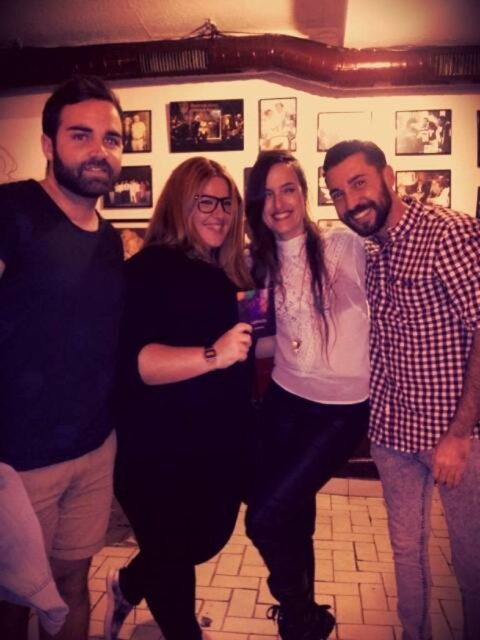
Question: Estimate the real-world distances between objects in this image. Which object is farther from the red checkered shirt at right?

Choices:
 (A) black matte shirt at left
 (B) wooden photo frame at upper center

Answer: (B)

Question: Is red checkered shirt at right to the right of wooden photo frame at upper center from the viewer's perspective?

Choices:
 (A) yes
 (B) no

Answer: (A)

Question: Among these objects, which one is nearest to the camera?

Choices:
 (A) wooden photo frame at upper center
 (B) black matte shirt at left
 (C) red checkered shirt at right

Answer: (B)

Question: Is black matte shirt at left to the right of wooden photo frame at upper center from the viewer's perspective?

Choices:
 (A) no
 (B) yes

Answer: (A)

Question: Can you confirm if black matte shirt at left is wider than wooden photo frame at upper center?

Choices:
 (A) no
 (B) yes

Answer: (A)

Question: Among these objects, which one is nearest to the camera?

Choices:
 (A) wooden photo frame at upper center
 (B) red checkered shirt at right

Answer: (B)